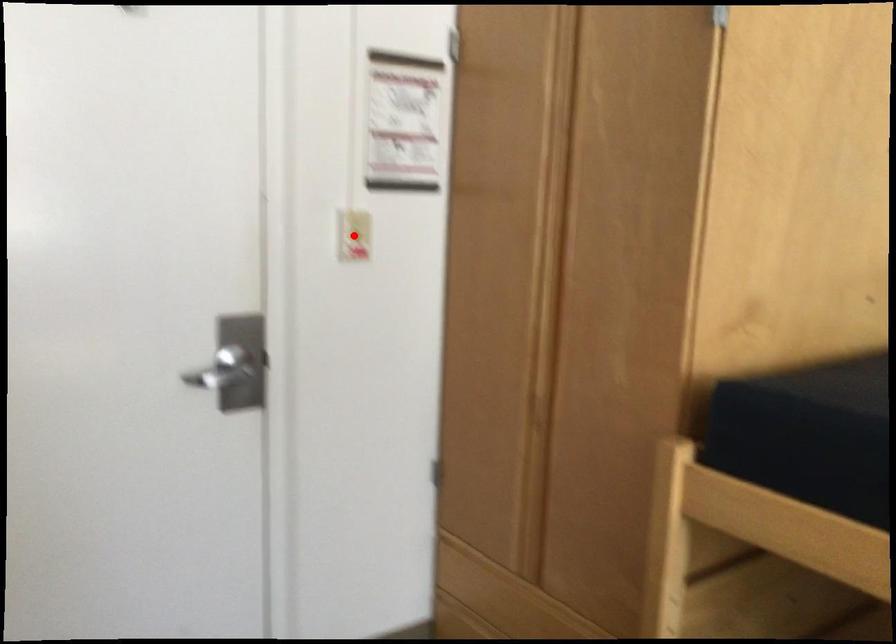
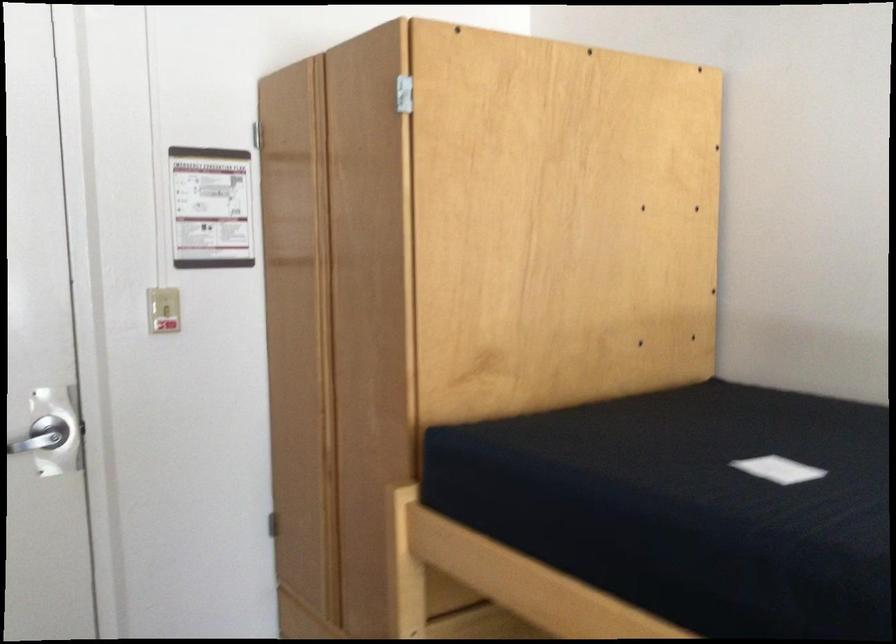
Locate, in the second image, the point that corresponds to the highlighted location in the first image.

(162, 308)